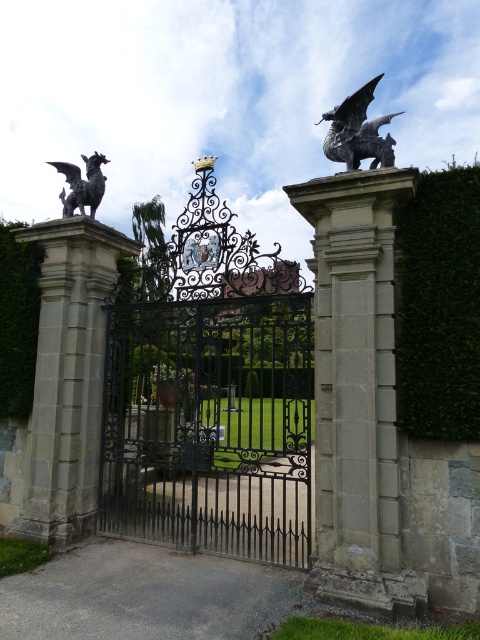
Who is lower down, black wrought iron gate at center or black polished stone gargoyle at left?

black wrought iron gate at center is below.

Where is `black wrought iron gate at center`? The width and height of the screenshot is (480, 640). black wrought iron gate at center is located at coordinates click(210, 426).

Is black wrought iron gate at center positioned in front of green leafy hedge at right?

No, it is behind green leafy hedge at right.

Is black wrought iron gate at center smaller than green leafy hedge at right?

Incorrect, black wrought iron gate at center is not smaller in size than green leafy hedge at right.

Which is behind, point (167, 436) or point (396, 230)?

The point (167, 436) is behind.

Image resolution: width=480 pixels, height=640 pixels. Find the location of `black wrought iron gate at center`. black wrought iron gate at center is located at coordinates (210, 426).

Does black wrought iron gate at center have a larger size compared to green leafy hedge at left?

Indeed, black wrought iron gate at center has a larger size compared to green leafy hedge at left.

Who is lower down, black wrought iron gate at center or green leafy hedge at left?

Positioned lower is black wrought iron gate at center.

Which is in front, point (288, 488) or point (29, 356)?

Point (29, 356)

At what (x,y) coordinates should I click in order to perform the action: click on black wrought iron gate at center. Please return your answer as a coordinate pair (x, y). The height and width of the screenshot is (640, 480). Looking at the image, I should click on (210, 426).